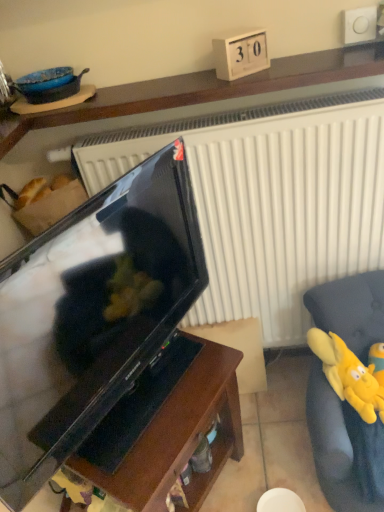
Image resolution: width=384 pixels, height=512 pixels. What are the coordinates of `empty space that is ontop of wooden shelf at upper center, the third furniture in the bottom-to-top sequence (from a real-world perspective)` in the screenshot? It's located at (164, 83).